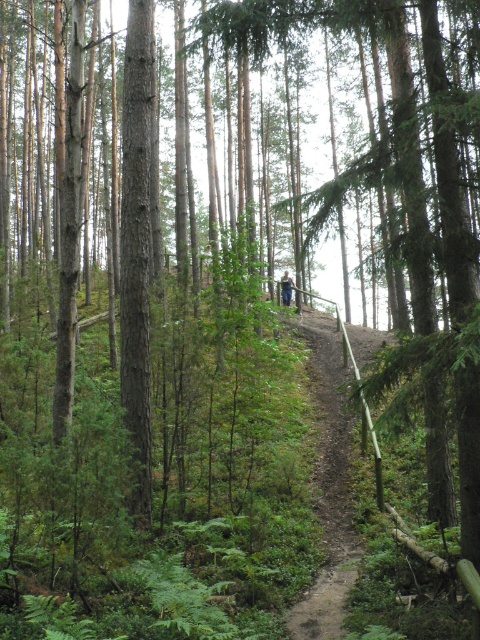
Between dirt path at center and blue jeans at center, which one has more height?

dirt path at center

Can you confirm if dirt path at center is positioned to the right of blue jeans at center?

Correct, you'll find dirt path at center to the right of blue jeans at center.

The width and height of the screenshot is (480, 640). I want to click on dirt path at center, so click(328, 481).

The height and width of the screenshot is (640, 480). I want to click on dirt path at center, so click(328, 481).